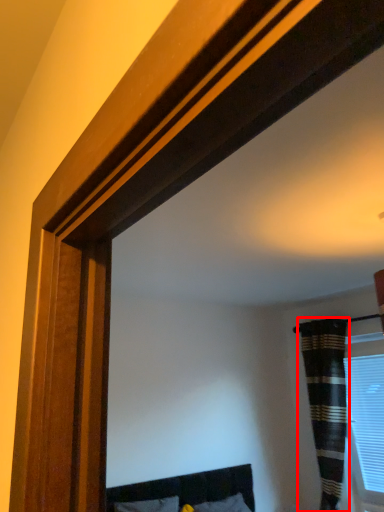
Question: From the image's perspective, considering the relative positions of curtain (annotated by the red box) and window in the image provided, where is curtain (annotated by the red box) located with respect to the staircase?

Choices:
 (A) below
 (B) above

Answer: (B)